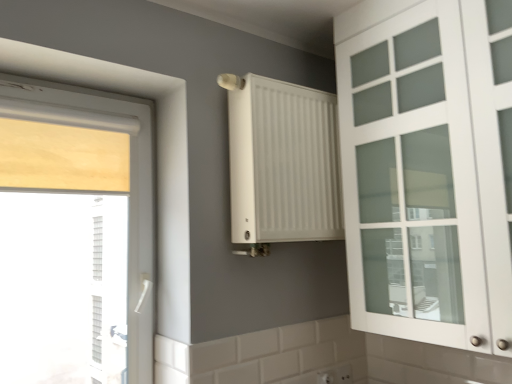
Question: Considering the relative sizes of white matte cabinet at right and white matte radiator at center in the image provided, is white matte cabinet at right shorter than white matte radiator at center?

Choices:
 (A) yes
 (B) no

Answer: (B)

Question: Considering the relative sizes of white matte cabinet at right and white matte radiator at center in the image provided, is white matte cabinet at right bigger than white matte radiator at center?

Choices:
 (A) yes
 (B) no

Answer: (A)

Question: Is white matte cabinet at right not within white matte radiator at center?

Choices:
 (A) no
 (B) yes

Answer: (B)

Question: Can you see white matte cabinet at right touching white matte radiator at center?

Choices:
 (A) yes
 (B) no

Answer: (B)

Question: Would you say white matte radiator at center is part of white matte cabinet at right's contents?

Choices:
 (A) no
 (B) yes

Answer: (A)

Question: Looking at their shapes, would you say wooden blind at left is wider or thinner than white matte cabinet at right?

Choices:
 (A) thin
 (B) wide

Answer: (A)

Question: Relative to white matte cabinet at right, is wooden blind at left in front or behind?

Choices:
 (A) behind
 (B) front

Answer: (A)

Question: Considering the positions of wooden blind at left and white matte cabinet at right in the image, is wooden blind at left taller or shorter than white matte cabinet at right?

Choices:
 (A) short
 (B) tall

Answer: (A)

Question: Does point (31, 223) appear closer or farther from the camera than point (501, 100)?

Choices:
 (A) farther
 (B) closer

Answer: (A)

Question: In terms of height, does white plastic electric outlet at lower center look taller or shorter compared to wooden blind at left?

Choices:
 (A) short
 (B) tall

Answer: (A)

Question: Would you say white plastic electric outlet at lower center is to the left or to the right of wooden blind at left in the picture?

Choices:
 (A) right
 (B) left

Answer: (A)

Question: Considering the positions of white plastic electric outlet at lower center and wooden blind at left in the image, is white plastic electric outlet at lower center bigger or smaller than wooden blind at left?

Choices:
 (A) small
 (B) big

Answer: (A)

Question: Do you think white plastic electric outlet at lower center is within wooden blind at left, or outside of it?

Choices:
 (A) outside
 (B) inside

Answer: (A)

Question: Looking at the image, does white plastic electric outlet at lower center seem bigger or smaller compared to white matte cabinet at right?

Choices:
 (A) big
 (B) small

Answer: (B)

Question: In terms of width, does white plastic electric outlet at lower center look wider or thinner when compared to white matte cabinet at right?

Choices:
 (A) thin
 (B) wide

Answer: (A)